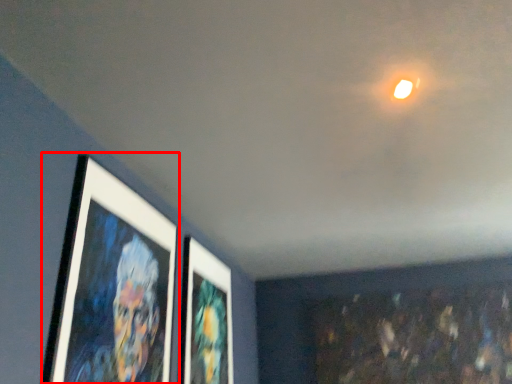
Question: From the image's perspective, what is the correct spatial relationship of picture frame (annotated by the red box) in relation to picture frame?

Choices:
 (A) above
 (B) below

Answer: (A)